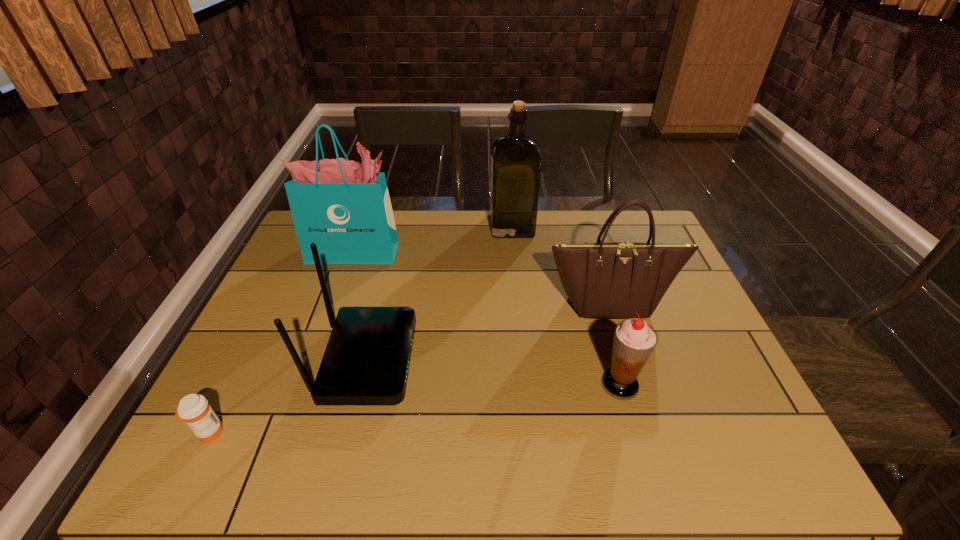
At what (x,y) coordinates should I click in order to perform the action: click on free region located on the right of the shopping bag. Please return your answer as a coordinate pair (x, y). Looking at the image, I should click on (433, 252).

The image size is (960, 540). I want to click on free space located 0.210m on the front-facing side of the fourth shortest object, so click(x=636, y=388).

Where is `blank space located on the front-facing side of the third shortest object`? blank space located on the front-facing side of the third shortest object is located at coordinates (482, 360).

I want to click on vacant area situated on the left of the smoothie, so click(445, 384).

Where is `free space located 0.130m on the right of the nearest object`? The height and width of the screenshot is (540, 960). free space located 0.130m on the right of the nearest object is located at coordinates (285, 434).

Locate an element on the screen. The width and height of the screenshot is (960, 540). liquor that is at the far edge is located at coordinates (516, 158).

Find the location of a particular element. shopping bag that is at the far edge is located at coordinates (344, 207).

The width and height of the screenshot is (960, 540). What are the coordinates of `object located in the near edge section of the desktop` in the screenshot? It's located at (194, 409).

Image resolution: width=960 pixels, height=540 pixels. Find the location of `shopping bag present at the left edge`. shopping bag present at the left edge is located at coordinates (344, 207).

Where is `medicine present at the left edge`? This screenshot has height=540, width=960. medicine present at the left edge is located at coordinates (194, 409).